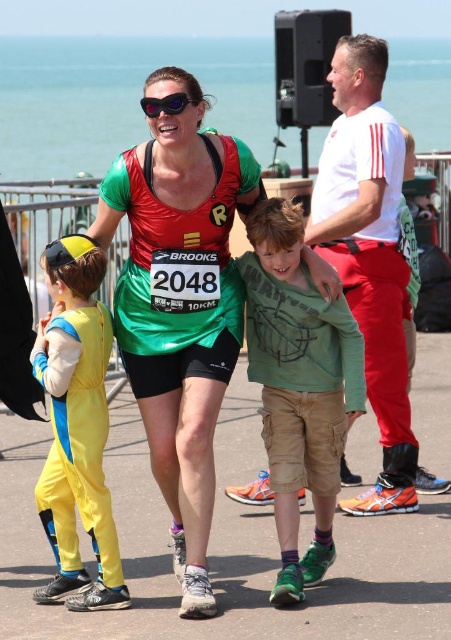
Does yellow/blue fabric jumpsuit at left appear on the right side of purple reflective sunglasses at center?

Incorrect, yellow/blue fabric jumpsuit at left is not on the right side of purple reflective sunglasses at center.

Consider the image. Does yellow/blue fabric jumpsuit at left appear on the left side of purple reflective sunglasses at center?

Indeed, yellow/blue fabric jumpsuit at left is positioned on the left side of purple reflective sunglasses at center.

Does point (50, 288) come farther from viewer compared to point (175, 109)?

Yes.

This screenshot has width=451, height=640. What are the coordinates of `yellow/blue fabric jumpsuit at left` in the screenshot? It's located at (77, 426).

Is matte green tank top at center positioned behind yellow/blue fabric jumpsuit at left?

That is False.

Is point (170, 342) less distant than point (59, 596)?

No.

Where is `matte green tank top at center`? matte green tank top at center is located at coordinates (179, 305).

Who is more forward, (x=189, y=426) or (x=308, y=413)?

Point (x=189, y=426)

Image resolution: width=451 pixels, height=640 pixels. Identify the location of matte green tank top at center. (179, 305).